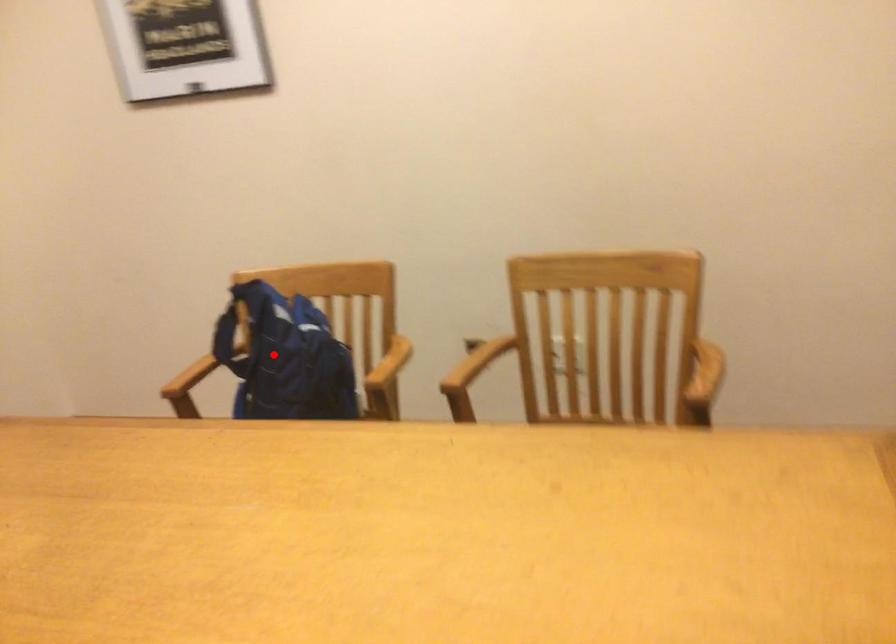
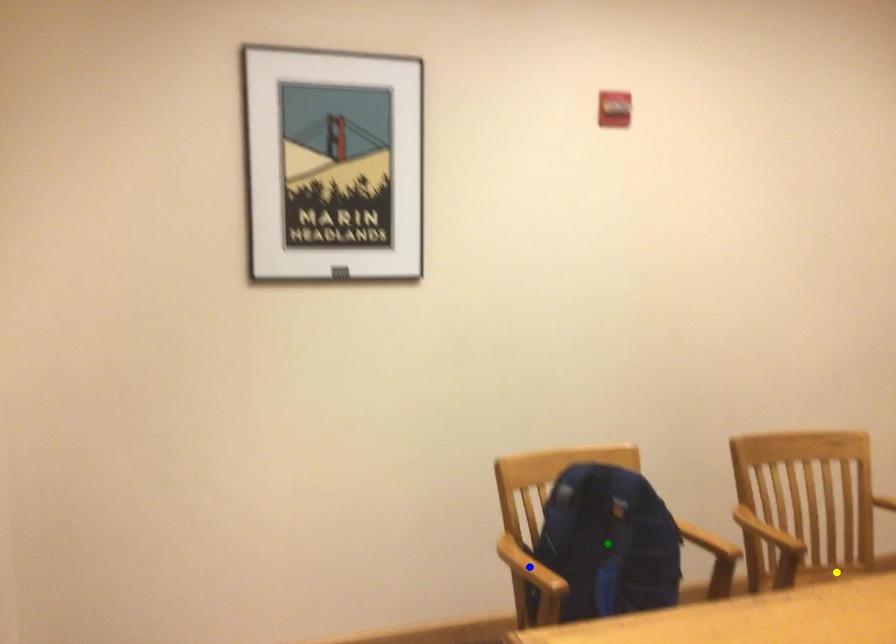
Question: I am providing you with two images of the same scene from different viewpoints. A red point is marked on the first image. You are given multiple points on the second image. Which mark in image 2 goes with the point in image 1?

Choices:
 (A) blue point
 (B) yellow point
 (C) green point

Answer: (C)